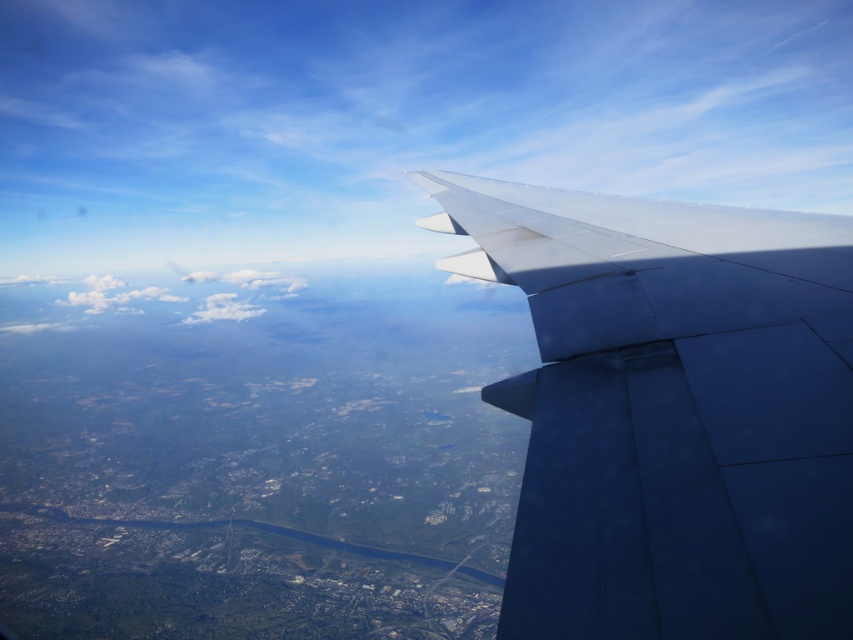
Question: Is satin blue wing at right smaller than white fluffy cloud at center?

Choices:
 (A) no
 (B) yes

Answer: (B)

Question: Which point is closer to the camera?

Choices:
 (A) (190, 323)
 (B) (537, 314)

Answer: (B)

Question: Which point appears closest to the camera in this image?

Choices:
 (A) (230, 298)
 (B) (798, 218)

Answer: (B)

Question: Is satin blue wing at right below white fluffy cloud at center?

Choices:
 (A) no
 (B) yes

Answer: (B)

Question: Which object appears closest to the camera in this image?

Choices:
 (A) satin blue wing at right
 (B) white fluffy cloud at center

Answer: (A)

Question: Does satin blue wing at right have a greater width compared to white fluffy cloud at center?

Choices:
 (A) yes
 (B) no

Answer: (B)